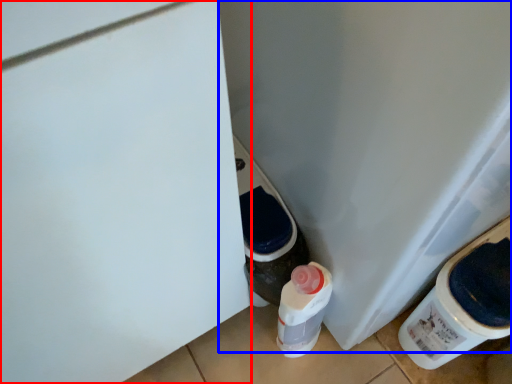
Question: Which object is closer to the camera taking this photo, door (highlighted by a red box) or water cooler (highlighted by a blue box)?

Choices:
 (A) door
 (B) water cooler

Answer: (A)